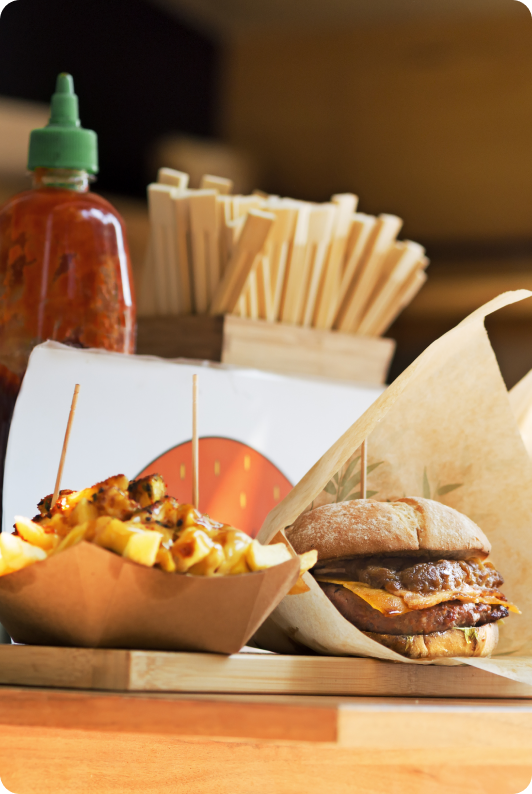
In order to click on wooden tray in this screenshot , I will do `click(128, 673)`, `click(343, 679)`, `click(34, 661)`, `click(459, 677)`.